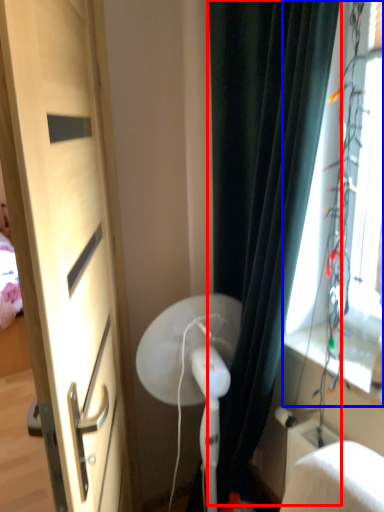
Question: Among these objects, which one is farthest to the camera, curtain (highlighted by a red box) or window screen (highlighted by a blue box)?

Choices:
 (A) curtain
 (B) window screen

Answer: (A)